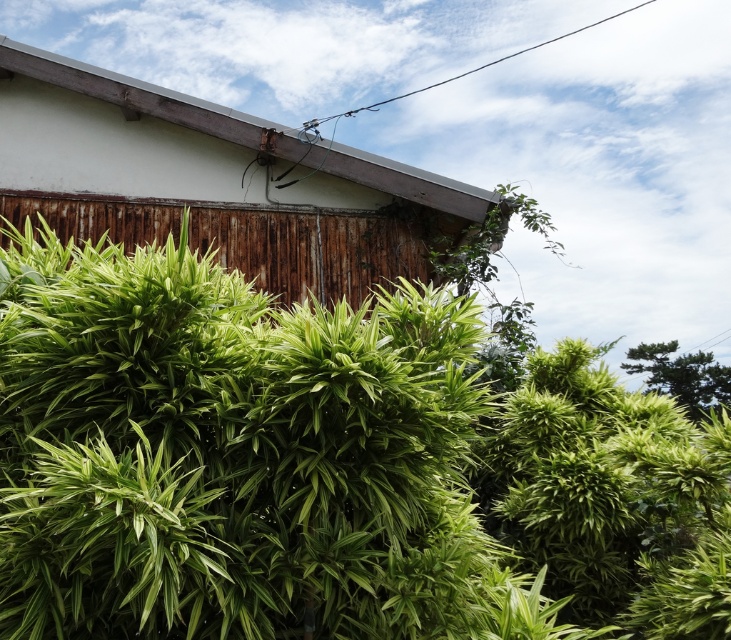
Is green leafy plant at center closer to camera compared to green leafy tree at upper right?

That is True.

Is green leafy plant at center smaller than green leafy tree at upper right?

No, green leafy plant at center is not smaller than green leafy tree at upper right.

Describe the element at coordinates (325, 465) in the screenshot. I see `green leafy plant at center` at that location.

Locate an element on the screen. The height and width of the screenshot is (640, 731). green leafy plant at center is located at coordinates (325, 465).

Can you confirm if green leafy plant at center is positioned to the left of rusty wood hut at upper center?

In fact, green leafy plant at center is to the right of rusty wood hut at upper center.

The height and width of the screenshot is (640, 731). Identify the location of green leafy plant at center. (325, 465).

Is point (648, 515) closer to viewer compared to point (102, 173)?

Yes, it is.

Locate an element on the screen. This screenshot has width=731, height=640. green leafy plant at center is located at coordinates (325, 465).

Locate an element on the screen. This screenshot has width=731, height=640. rusty wood hut at upper center is located at coordinates (213, 180).

Is rusty wood hut at upper center closer to the viewer compared to green leafy tree at upper right?

Yes, it is in front of green leafy tree at upper right.

Measure the distance between point (x=61, y=129) and camera.

16.95 feet

Locate an element on the screen. rusty wood hut at upper center is located at coordinates (213, 180).